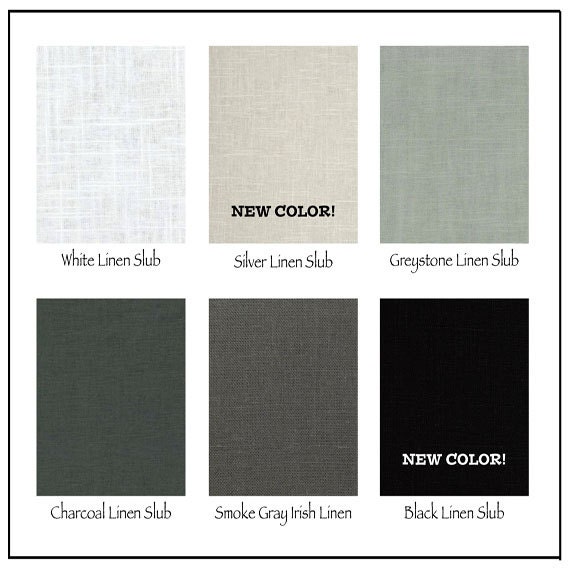
At what (x,y) coordinates should I click in order to perform the action: click on black linen. Please return your answer as a coordinate pair (x, y). The width and height of the screenshot is (570, 570). Looking at the image, I should click on (419, 510).